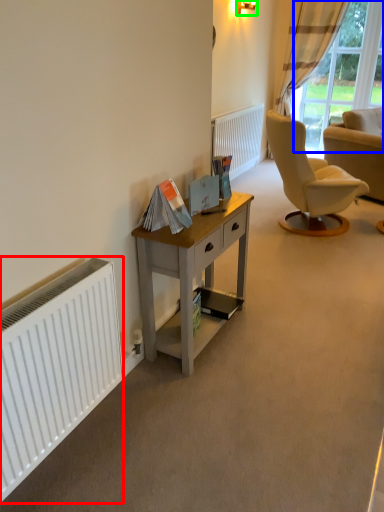
Question: Which is nearer to the radiator (highlighted by a red box)? bay window (highlighted by a blue box) or lamp (highlighted by a green box).

Choices:
 (A) bay window
 (B) lamp

Answer: (B)